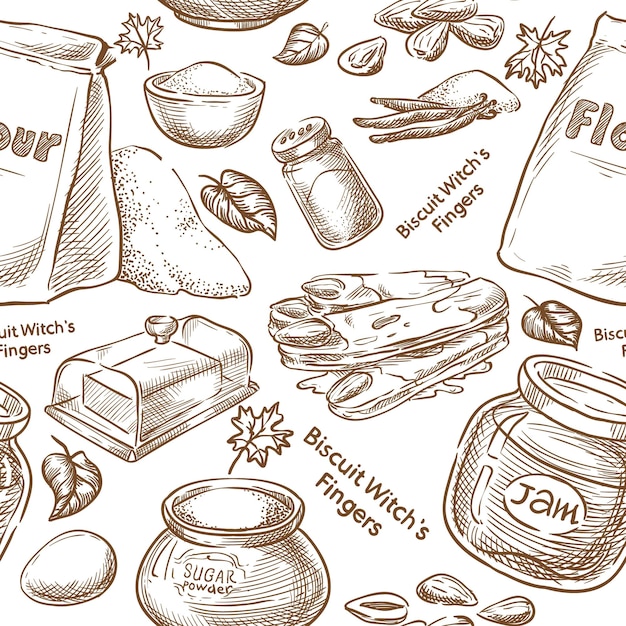
Where is `butter crock`? The width and height of the screenshot is (626, 626). butter crock is located at coordinates click(390, 320), click(163, 372).